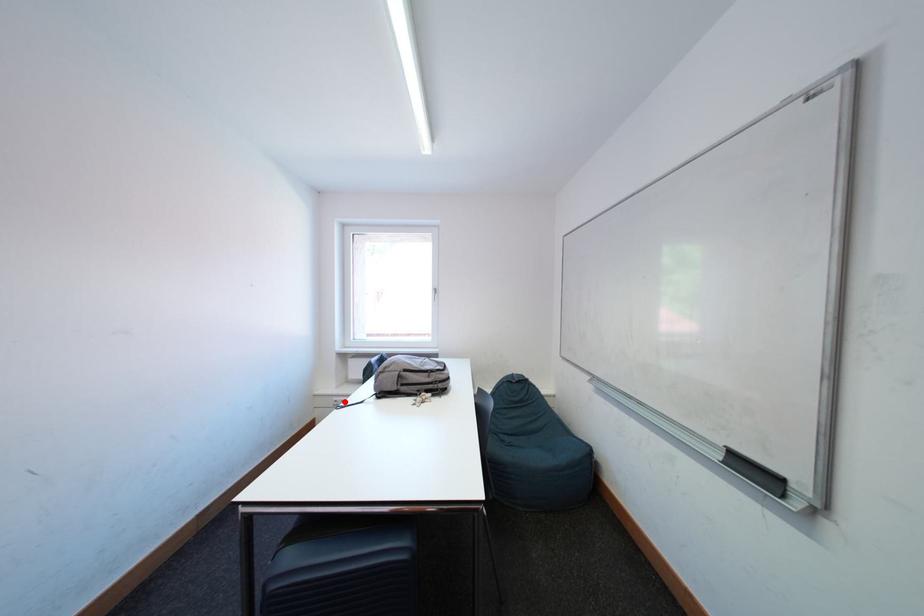
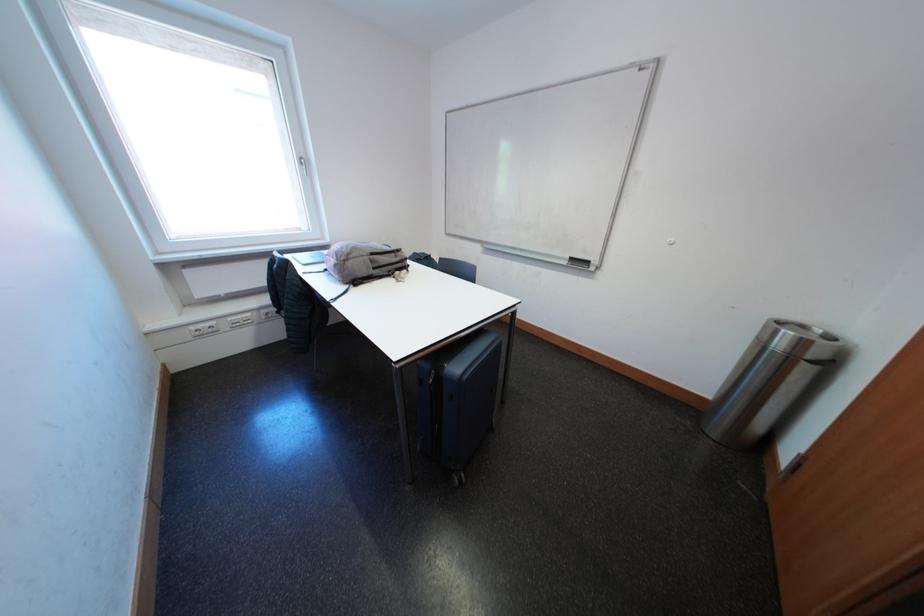
Find the pixel in the second image that matches the highlighted location in the first image.

(202, 331)